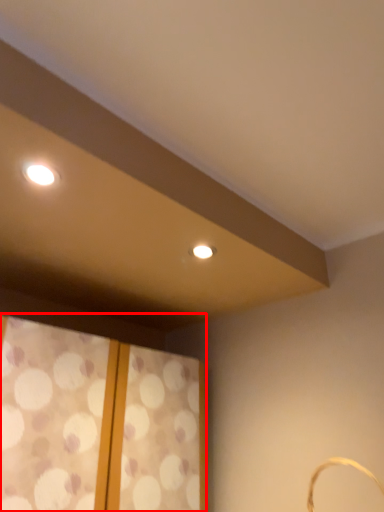
Question: Considering the relative positions of window (annotated by the red box) and basket in the image provided, where is window (annotated by the red box) located with respect to the staircase?

Choices:
 (A) left
 (B) right

Answer: (A)